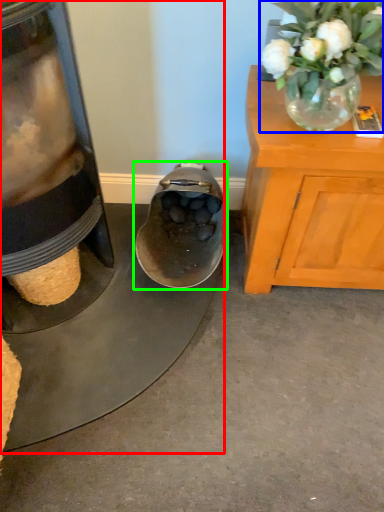
Question: Estimate the real-world distances between objects in this image. Which object is farther from appliance (highlighted by a red box), floral arrangement (highlighted by a blue box) or footwear (highlighted by a green box)?

Choices:
 (A) floral arrangement
 (B) footwear

Answer: (A)